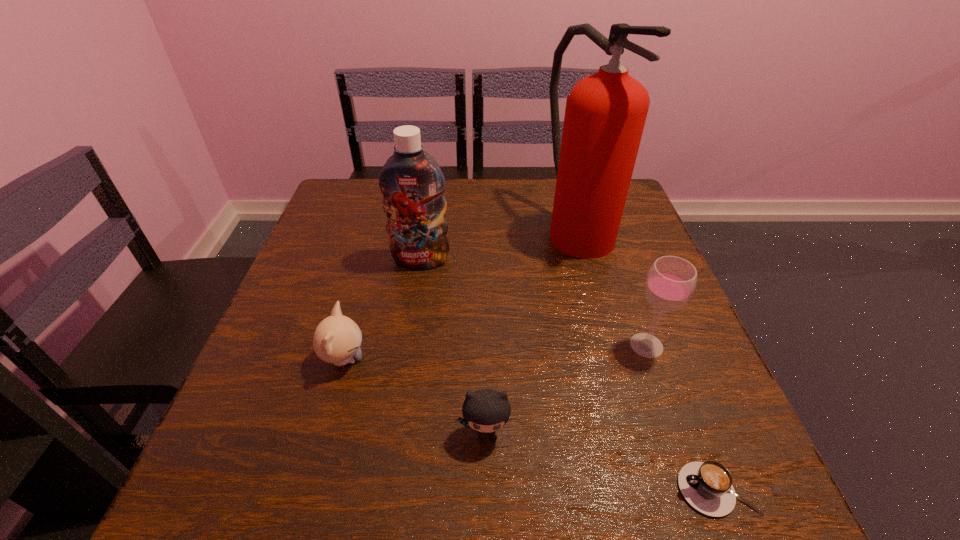
At what (x,y) coordinates should I click in order to perform the action: click on vacant point located 0.120m on the handle side of the tallest object. Please return your answer as a coordinate pair (x, y). Image resolution: width=960 pixels, height=540 pixels. Looking at the image, I should click on (598, 302).

The width and height of the screenshot is (960, 540). I want to click on vacant space located 0.120m on the front label of the second object from left to right, so click(x=413, y=310).

At what (x,y) coordinates should I click in order to perform the action: click on vacant space situated 0.070m on the back of the fourth shortest object. Please return your answer as a coordinate pair (x, y). The image size is (960, 540). Looking at the image, I should click on (632, 304).

At what (x,y) coordinates should I click in order to perform the action: click on free region located on the face of the left kitten. Please return your answer as a coordinate pair (x, y). Looking at the image, I should click on (438, 359).

At what (x,y) coordinates should I click in order to perform the action: click on free point located on the front-facing side of the third object from left to right. Please return your answer as a coordinate pair (x, y). This screenshot has width=960, height=540. Looking at the image, I should click on (487, 484).

The image size is (960, 540). Identify the location of free space located 0.380m with the handle on the side of the shortest object. (414, 489).

I want to click on vacant space located with the handle on the side of the shortest object, so click(525, 489).

At what (x,y) coordinates should I click in order to perform the action: click on vacant region located 0.220m with the handle on the side of the shortest object. Please return your answer as a coordinate pair (x, y). Looking at the image, I should click on point(525,489).

Where is `object present at the far edge`? Image resolution: width=960 pixels, height=540 pixels. object present at the far edge is located at coordinates [x=605, y=114].

Find the location of a particular element. The width and height of the screenshot is (960, 540). object that is positioned at the near edge is located at coordinates (707, 486).